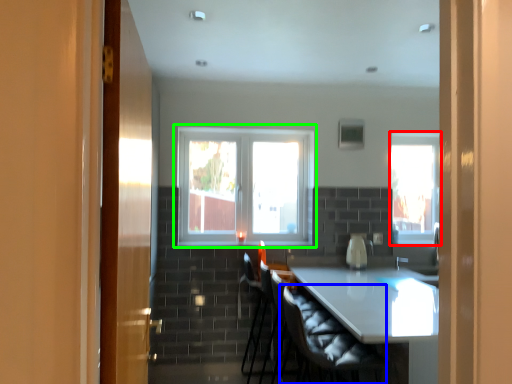
Question: Which object is the closest to the window (highlighted by a red box)? Choose among these: swivel chair (highlighted by a blue box) or window (highlighted by a green box).

Choices:
 (A) swivel chair
 (B) window

Answer: (B)